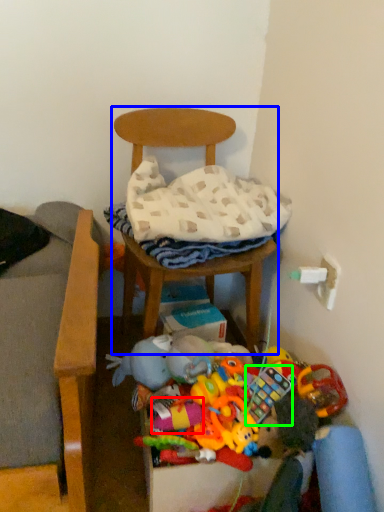
Question: Based on their relative distances, which object is farther from toy (highlighted by a red box)? Choose from chair (highlighted by a blue box) and toy (highlighted by a green box).

Choices:
 (A) chair
 (B) toy

Answer: (A)